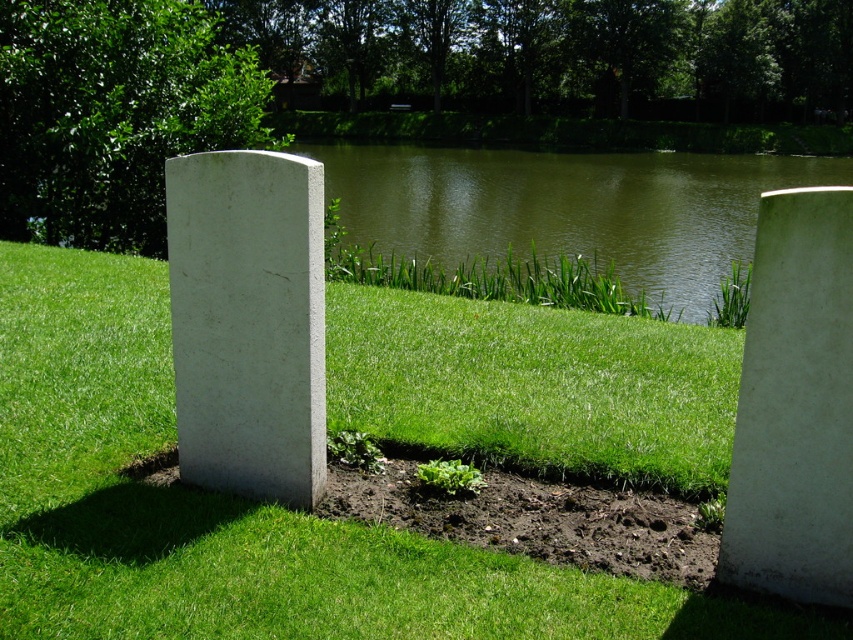
Question: Among these points, which one is nearest to the camera?

Choices:
 (A) (756, 266)
 (B) (369, 196)

Answer: (A)

Question: Which point is farther from the camera taking this photo?

Choices:
 (A) (293, 448)
 (B) (148, 522)

Answer: (A)

Question: From the image, what is the correct spatial relationship of green grassy at center in relation to white concrete at right?

Choices:
 (A) left
 (B) right

Answer: (B)

Question: Considering the real-world distances, which object is farthest from the white marble gravestone at center?

Choices:
 (A) green water at center
 (B) green grassy at center
 (C) white concrete at right

Answer: (A)

Question: Does green grassy at center have a lesser width compared to white marble gravestone at center?

Choices:
 (A) yes
 (B) no

Answer: (B)

Question: Can you confirm if white marble gravestone at center is positioned above green water at center?

Choices:
 (A) yes
 (B) no

Answer: (B)